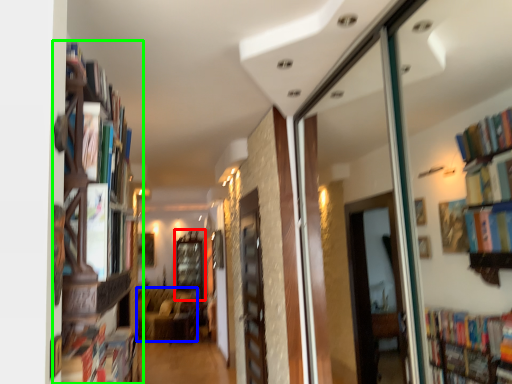
Question: Which is farther away from window (highlighted by a red box)? furniture (highlighted by a blue box) or bookcase (highlighted by a green box)?

Choices:
 (A) furniture
 (B) bookcase

Answer: (B)